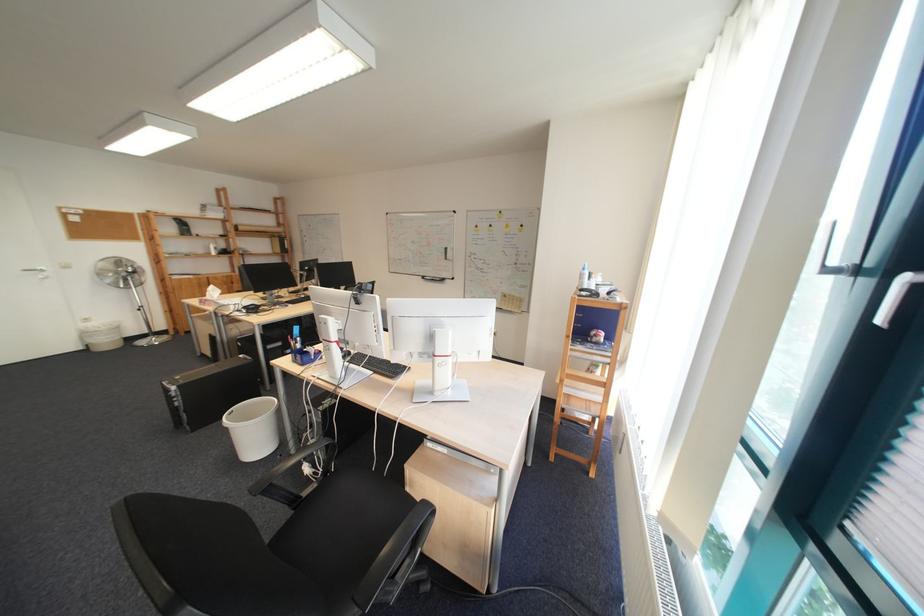
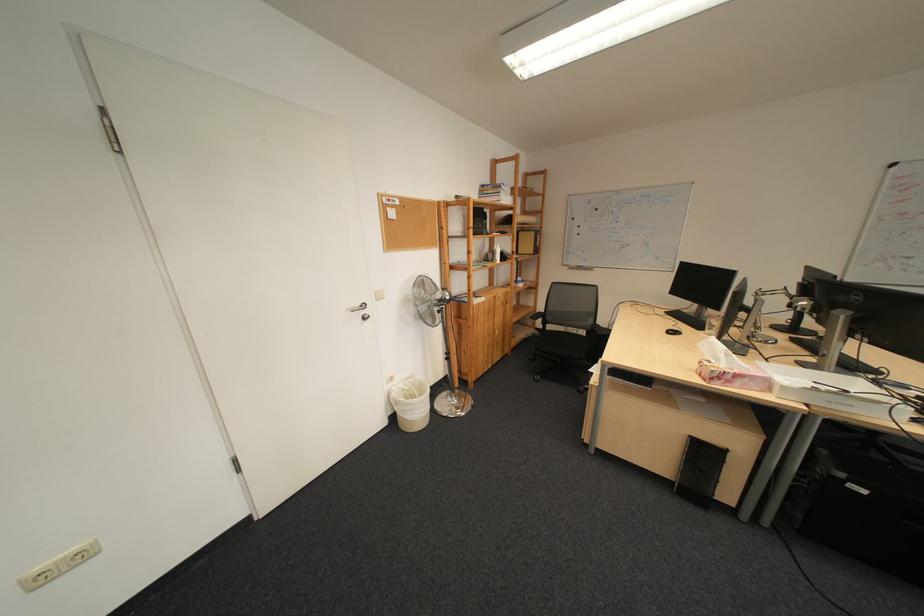
Find the pixel in the second image that matches point 134,262 in the first image.

(435, 284)